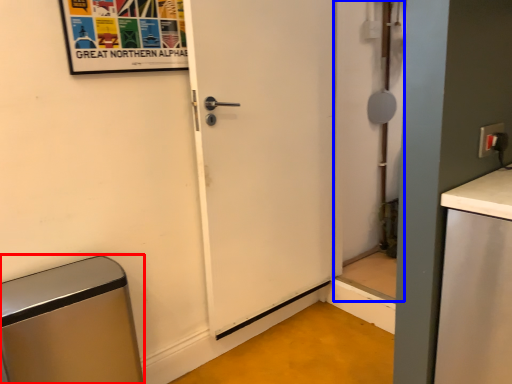
Question: Which point is closer to the camera, appliance (highlighted by a red box) or screen door (highlighted by a blue box)?

Choices:
 (A) appliance
 (B) screen door

Answer: (A)